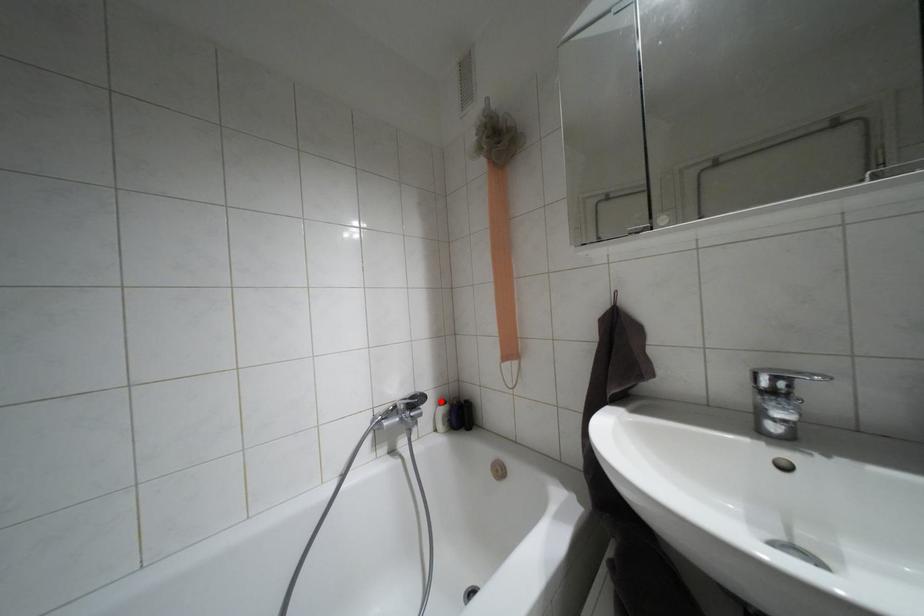
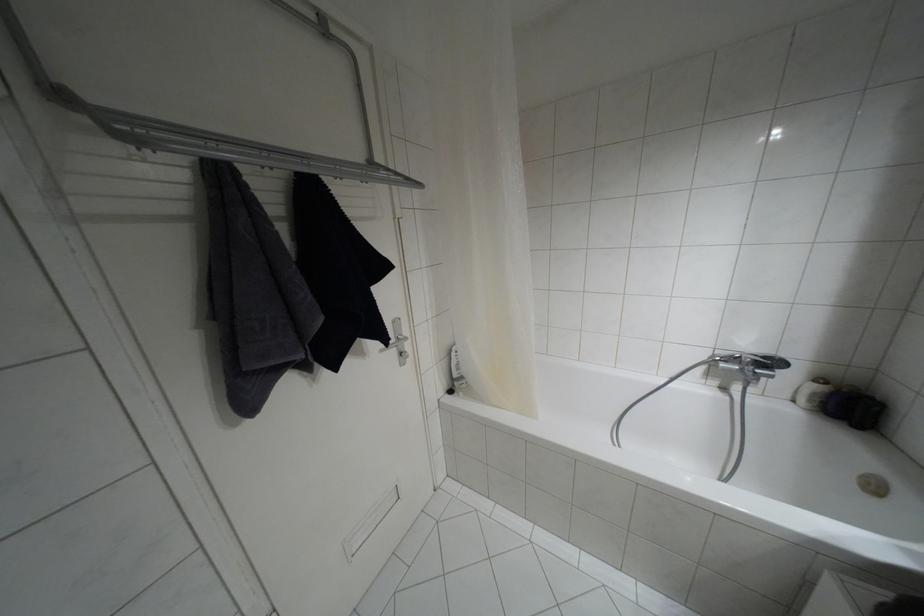
In the second image, find the point that corresponds to the highlighted location in the first image.

(820, 379)